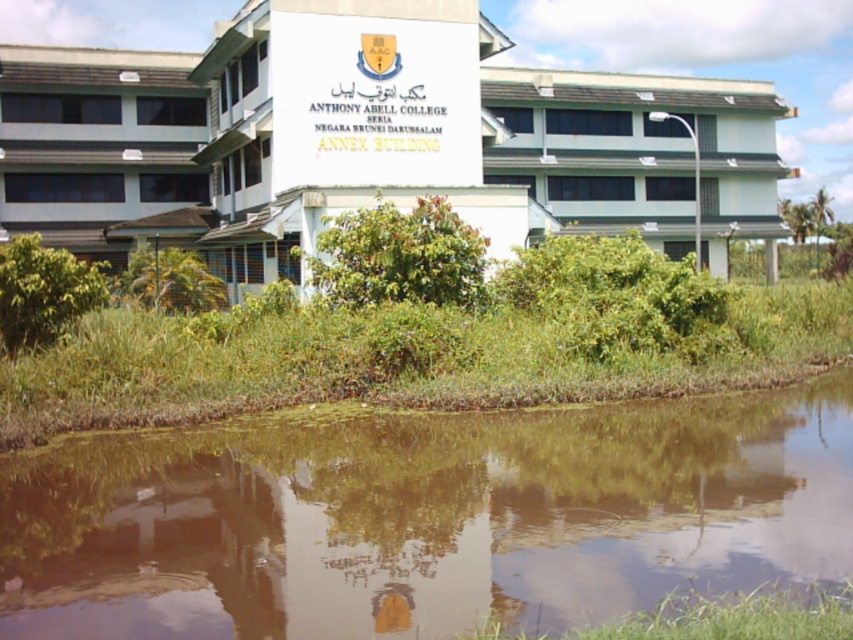
Which of these two, green mossy water at lower center or white smooth building at center, stands taller?

white smooth building at center is taller.

Is point (664, 500) positioned after point (703, 172)?

No.

Between point (183, 516) and point (688, 157), which one is positioned behind?

The point (688, 157) is behind.

Find the location of a particular element. The width and height of the screenshot is (853, 640). green mossy water at lower center is located at coordinates (425, 518).